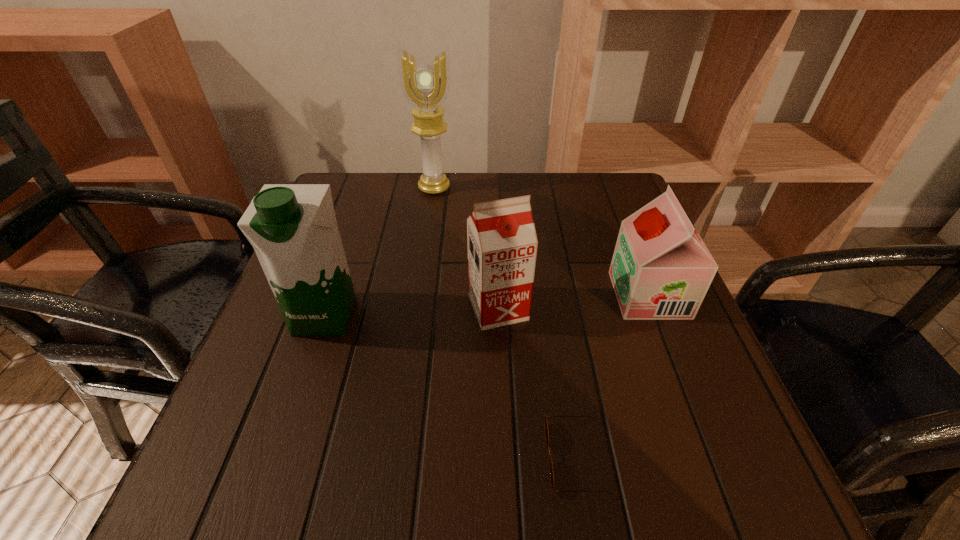
Identify which soya milk is the nearest to the leftmost soya milk. Please provide its 2D coordinates. Your answer should be formatted as a tuple, i.e. [(x, y)], where the tuple contains the x and y coordinates of a point satisfying the conditions above.

[(502, 244)]

Select which soya milk is the closest to the shortest soya milk. Please provide its 2D coordinates. Your answer should be formatted as a tuple, i.e. [(x, y)], where the tuple contains the x and y coordinates of a point satisfying the conditions above.

[(502, 244)]

This screenshot has height=540, width=960. Find the location of `vacant area in the image that satisfies the following two spatial constraints: 1. on the front-facing side of the second soya milk from right to left; 2. on the left side of the fourth object from right to left`. vacant area in the image that satisfies the following two spatial constraints: 1. on the front-facing side of the second soya milk from right to left; 2. on the left side of the fourth object from right to left is located at coordinates (418, 308).

Find the location of a particular element. The image size is (960, 540). blank area in the image that satisfies the following two spatial constraints: 1. with the cap open on the fourth tallest object; 2. on the front-facing side of the leftmost soya milk is located at coordinates (657, 315).